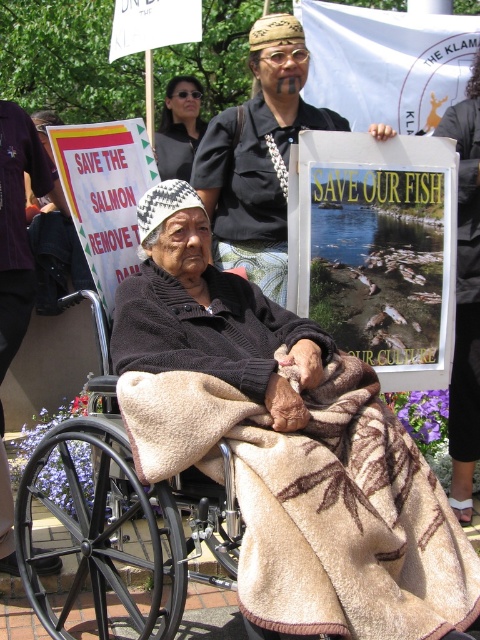
Question: Among these points, which one is farthest from the camera?

Choices:
 (A) (316, 115)
 (B) (90, 428)
 (C) (160, 147)

Answer: (C)

Question: Is black fabric shirt at center below matte black sunglasses at upper center?

Choices:
 (A) yes
 (B) no

Answer: (A)

Question: Can you confirm if beige woolen blanket at center is smaller than black metal wheelchair at lower left?

Choices:
 (A) yes
 (B) no

Answer: (A)

Question: Which of these objects is positioned farthest from the black fabric shirt at center?

Choices:
 (A) black metal wheelchair at lower left
 (B) beige woolen blanket at center
 (C) matte black sunglasses at upper center

Answer: (C)

Question: Does beige woolen blanket at center appear under matte black sunglasses at upper center?

Choices:
 (A) yes
 (B) no

Answer: (A)

Question: Which of the following is the farthest from the observer?

Choices:
 (A) coord(166,115)
 (B) coord(284,134)
 (C) coord(286,628)

Answer: (A)